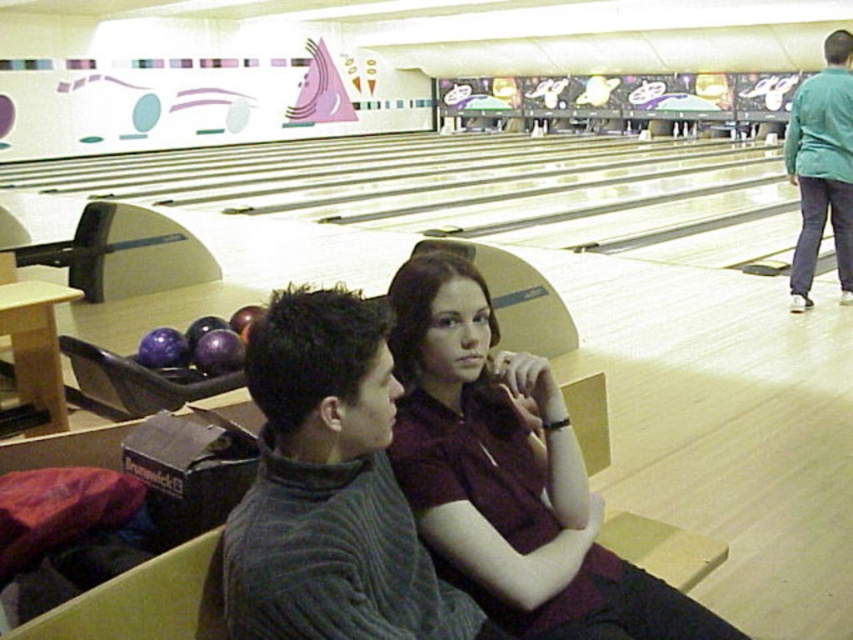
Who is more distant from viewer, (840, 218) or (173, 360)?

Point (840, 218)

At what (x,y) coordinates should I click in order to perform the action: click on green fabric shirt at upper right. Please return your answer as a coordinate pair (x, y). Looking at the image, I should click on (822, 168).

Is dark gray ribbed sweater at center thinner than purple matte bowling ball at left?

In fact, dark gray ribbed sweater at center might be wider than purple matte bowling ball at left.

Can you confirm if dark gray ribbed sweater at center is shorter than purple matte bowling ball at left?

Incorrect, dark gray ribbed sweater at center's height does not fall short of purple matte bowling ball at left's.

Is point (369, 324) less distant than point (164, 340)?

Yes, it is.

Image resolution: width=853 pixels, height=640 pixels. Identify the location of dark gray ribbed sweater at center. (329, 490).

Is maroon fabric shirt at center positioned behind dark gray ribbed sweater at center?

That is True.

Which is more to the right, maroon fabric shirt at center or dark gray ribbed sweater at center?

maroon fabric shirt at center

Image resolution: width=853 pixels, height=640 pixels. I want to click on maroon fabric shirt at center, so click(x=508, y=476).